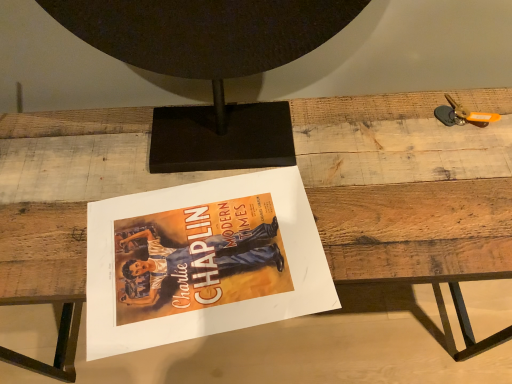
In order to click on matte black round table at center in this screenshot , I will do `click(205, 34)`.

What do you see at coordinates (205, 34) in the screenshot? I see `matte black round table at center` at bounding box center [205, 34].

I want to click on matte black round table at center, so click(205, 34).